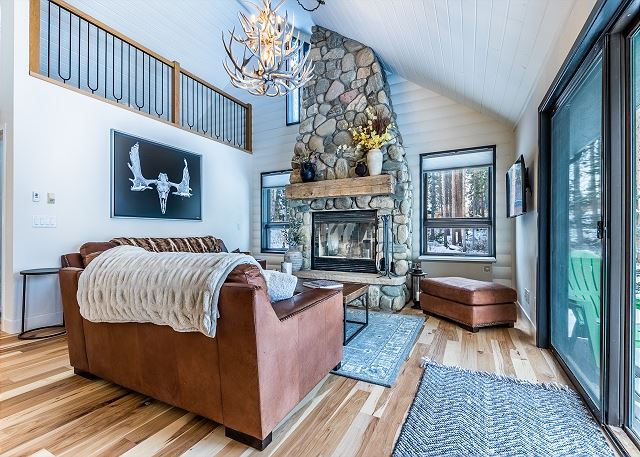
Where is `fireplace`? This screenshot has width=640, height=457. fireplace is located at coordinates (328, 224), (364, 225), (361, 249), (331, 249).